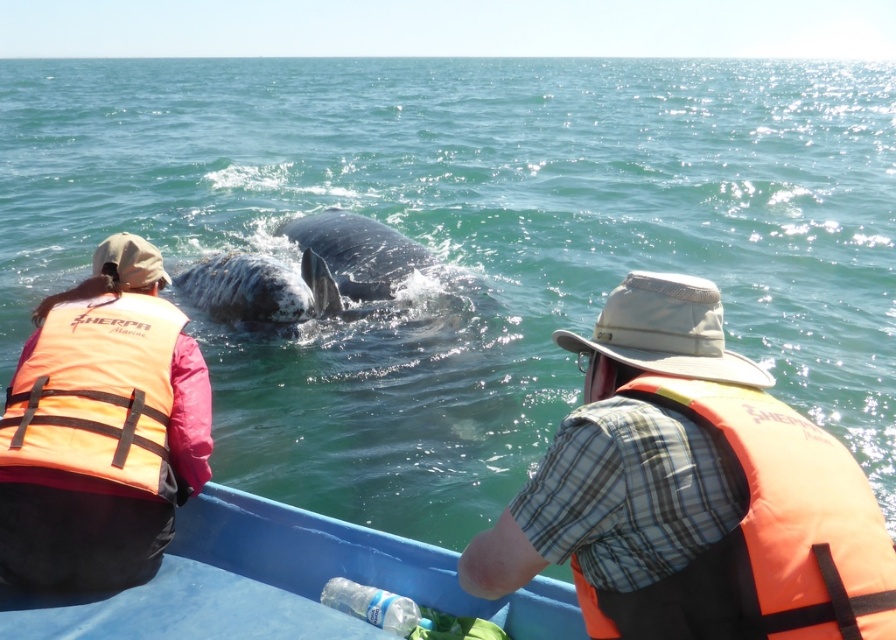
Is blue plastic boat at lower center above clear plastic bottle at lower center?

Indeed, blue plastic boat at lower center is positioned over clear plastic bottle at lower center.

Does point (209, 614) come closer to viewer compared to point (334, 605)?

Yes, it is.

You are a GUI agent. You are given a task and a screenshot of the screen. Output one action in this format:
    pyautogui.click(x=<x>, y=<y>)
    Task: Click on the blue plastic boat at lower center
    The height and width of the screenshot is (640, 896).
    Given the screenshot: What is the action you would take?
    pyautogui.click(x=280, y=582)

Is orange fabric life jacket at right shorter than blue plastic boat at lower center?

Incorrect, orange fabric life jacket at right's height does not fall short of blue plastic boat at lower center's.

Is point (874, 513) positioned in front of point (260, 513)?

Yes, point (874, 513) is in front of point (260, 513).

Does point (657, 589) come in front of point (309, 566)?

Yes.

Where is `orange fabric life jacket at right`? orange fabric life jacket at right is located at coordinates (764, 534).

Which is more to the left, orange fabric life jacket at right or clear plastic bottle at lower center?

From the viewer's perspective, clear plastic bottle at lower center appears more on the left side.

Between orange fabric life jacket at right and clear plastic bottle at lower center, which one appears on the right side from the viewer's perspective?

Positioned to the right is orange fabric life jacket at right.

Does point (757, 628) lie in front of point (332, 584)?

That is True.

Where is `orange fabric life jacket at right`? orange fabric life jacket at right is located at coordinates (764, 534).